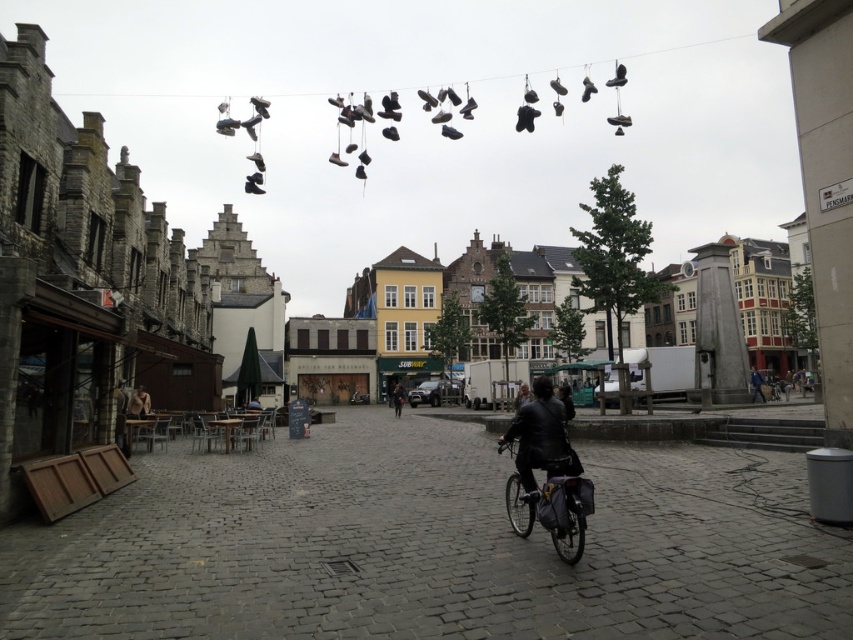
Is shiny metallic bicycle at center wider than blue denim jacket at center?

No.

Which is above, shiny metallic bicycle at center or blue denim jacket at center?

blue denim jacket at center is higher up.

Does point (582, 484) come in front of point (759, 385)?

Yes, point (582, 484) is closer to viewer.

In order to click on shiny metallic bicycle at center in this screenshot , I will do `click(553, 512)`.

What do you see at coordinates (553, 512) in the screenshot? I see `shiny metallic bicycle at center` at bounding box center [553, 512].

Is shiny metallic bicycle at center wider than dark brown leather jacket at center?

Correct, the width of shiny metallic bicycle at center exceeds that of dark brown leather jacket at center.

Is point (535, 499) more distant than point (401, 390)?

No, it is in front of (401, 390).

Where is `shiny metallic bicycle at center`? The image size is (853, 640). shiny metallic bicycle at center is located at coordinates (553, 512).

Between leather jacket at center and blue denim jacket at center, which one appears on the left side from the viewer's perspective?

Positioned to the left is leather jacket at center.

Between point (547, 397) and point (752, 378), which one is positioned behind?

Positioned behind is point (752, 378).

Where is `leather jacket at center`? leather jacket at center is located at coordinates (541, 438).